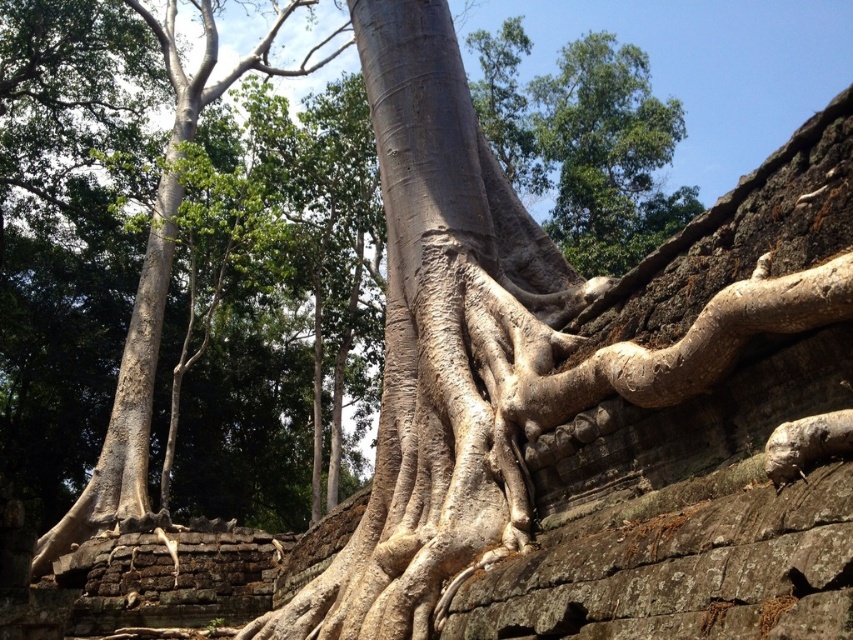
Question: Which point is closer to the camera?

Choices:
 (A) smooth gray bark at center
 (B) bark-like textured roots at center-right

Answer: (B)

Question: Considering the relative positions of smooth gray bark at center and smooth gray bark at left in the image provided, where is smooth gray bark at center located with respect to smooth gray bark at left?

Choices:
 (A) below
 (B) above

Answer: (A)

Question: Can you confirm if smooth gray bark at center is wider than smooth gray bark at left?

Choices:
 (A) yes
 (B) no

Answer: (B)

Question: Can you confirm if smooth gray bark at center is thinner than smooth gray bark at left?

Choices:
 (A) yes
 (B) no

Answer: (A)

Question: Which of the following is the farthest from the observer?

Choices:
 (A) bark-like textured roots at center-right
 (B) smooth gray bark at left
 (C) smooth gray bark at center

Answer: (B)

Question: Which object is positioned farthest from the smooth gray bark at left?

Choices:
 (A) bark-like textured roots at center-right
 (B) smooth gray bark at center

Answer: (A)